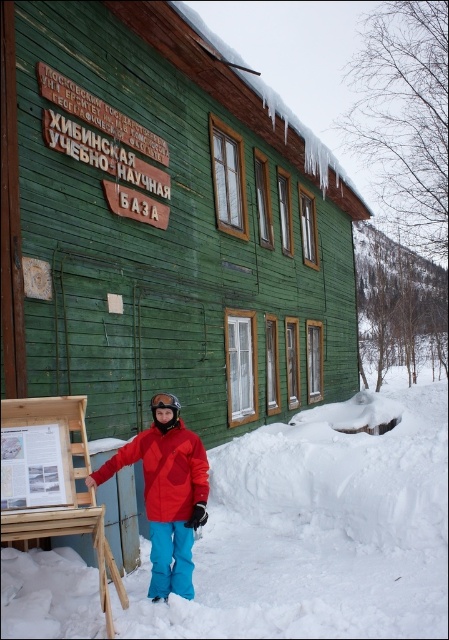
Question: Among these points, which one is farthest from the camera?

Choices:
 (A) (183, 464)
 (B) (162, 403)

Answer: (B)

Question: Can you confirm if white fluffy snow at lower center is bigger than red matte jacket at center?

Choices:
 (A) no
 (B) yes

Answer: (B)

Question: Can you confirm if white fluffy snow at lower center is positioned to the left of black matte goggles at center?

Choices:
 (A) no
 (B) yes

Answer: (A)

Question: Among these objects, which one is nearest to the camera?

Choices:
 (A) white fluffy snow at lower center
 (B) red matte jacket at center
 (C) black matte goggles at center

Answer: (A)

Question: Can you confirm if white fluffy snow at lower center is thinner than black matte goggles at center?

Choices:
 (A) yes
 (B) no

Answer: (B)

Question: Which point is closer to the camera?

Choices:
 (A) (157, 461)
 (B) (3, 577)

Answer: (B)